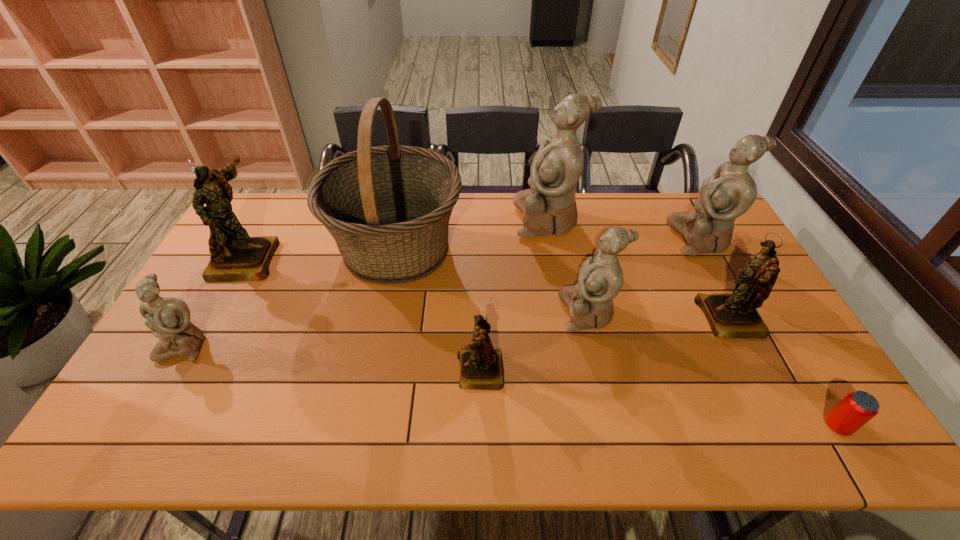
Find the location of a particular element. This screenshot has width=960, height=540. basket is located at coordinates (388, 208).

Find the location of a particular element. This screenshot has width=960, height=540. the biggest white figurine is located at coordinates (549, 207).

In order to click on the rightmost white figurine in this screenshot , I will do `click(730, 191)`.

You are a GUI agent. You are given a task and a screenshot of the screen. Output one action in this format:
    pyautogui.click(x=<x>, y=<y>)
    Task: Click on the farthest gold figurine
    
    Given the screenshot: What is the action you would take?
    pyautogui.click(x=235, y=256)

Identify the location of the biggest gold figurine. The width and height of the screenshot is (960, 540). (235, 256).

Identify the location of the second biggest gold figurine. The width and height of the screenshot is (960, 540). (734, 315).

Where is `the rightmost gold figurine`? This screenshot has height=540, width=960. the rightmost gold figurine is located at coordinates coord(734,315).

Where is `the second smallest white figurine`? This screenshot has height=540, width=960. the second smallest white figurine is located at coordinates (590, 302).

The image size is (960, 540). I want to click on the leftmost white figurine, so click(x=168, y=318).

This screenshot has width=960, height=540. In order to click on the second gold figurine from right to left in this screenshot , I will do `click(481, 367)`.